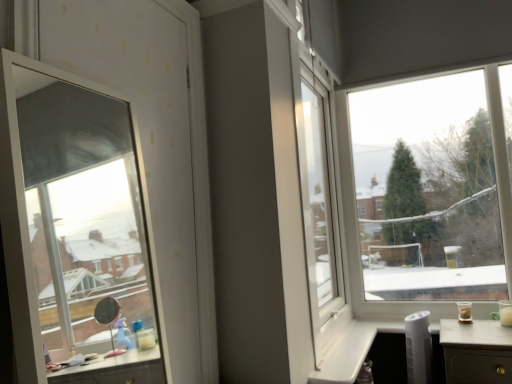
Image resolution: width=512 pixels, height=384 pixels. Find the location of `transparent glass window at left, which appears as the 1th window when viewed from the left`. transparent glass window at left, which appears as the 1th window when viewed from the left is located at coordinates (74, 231).

This screenshot has width=512, height=384. What do you see at coordinates (74, 231) in the screenshot? I see `transparent glass window at left, the second window viewed from the back` at bounding box center [74, 231].

Where is `transparent glass window at upper right, the 1th window when ordered from right to left`? This screenshot has height=384, width=512. transparent glass window at upper right, the 1th window when ordered from right to left is located at coordinates (426, 195).

What do you see at coordinates (426, 195) in the screenshot? I see `transparent glass window at upper right, which is counted as the second window, starting from the left` at bounding box center [426, 195].

Where is `transparent glass window at left, the second window viewed from the back`? This screenshot has width=512, height=384. transparent glass window at left, the second window viewed from the back is located at coordinates (74, 231).

Based on their positions, is transparent glass window at left, the second window viewed from the back, located to the left or right of transparent glass window at upper right, which is the 1th window from back to front?

In the image, transparent glass window at left, the second window viewed from the back, appears on the left side of transparent glass window at upper right, which is the 1th window from back to front.

Which is in front, transparent glass window at left, which is counted as the 2th window, starting from the right, or transparent glass window at upper right, which is counted as the second window, starting from the left?

transparent glass window at left, which is counted as the 2th window, starting from the right.

Which is closer, (x=111, y=93) or (x=503, y=205)?

Point (x=111, y=93) appears to be closer to the viewer than point (x=503, y=205).

From the image's perspective, is transparent glass window at left, the second window viewed from the back, beneath transparent glass window at upper right, which is counted as the second window, starting from the left?

Incorrect, from the image's perspective, transparent glass window at left, the second window viewed from the back, is higher than transparent glass window at upper right, which is counted as the second window, starting from the left.

From a real-world perspective, is transparent glass window at left, which appears as the 1th window when viewed from the left, above or below transparent glass window at upper right, the second window positioned from the front?

transparent glass window at left, which appears as the 1th window when viewed from the left, is above transparent glass window at upper right, the second window positioned from the front.

Between transparent glass window at left, which appears as the 1th window when viewed from the left, and transparent glass window at upper right, which is the 1th window from back to front, which one has smaller width?

Thinner between the two is transparent glass window at left, which appears as the 1th window when viewed from the left.

Between transparent glass window at left, the second window viewed from the back, and transparent glass window at upper right, which is the 1th window from back to front, which one has more height?

transparent glass window at upper right, which is the 1th window from back to front, is taller.

Does transparent glass window at left, arranged as the 1th window when viewed from the front, have a smaller size compared to transparent glass window at upper right, which is counted as the second window, starting from the left?

Yes.

Would you say transparent glass window at upper right, the second window positioned from the front, is part of transparent glass window at left, arranged as the 1th window when viewed from the front,'s contents?

No, transparent glass window at upper right, the second window positioned from the front, is not surrounded by transparent glass window at left, arranged as the 1th window when viewed from the front.

Are transparent glass window at left, which is counted as the 2th window, starting from the right, and transparent glass window at upper right, which is the 1th window from back to front, located far from each other?

That's right, there is a large distance between transparent glass window at left, which is counted as the 2th window, starting from the right, and transparent glass window at upper right, which is the 1th window from back to front.

Is transparent glass window at left, which is counted as the 2th window, starting from the right, facing towards transparent glass window at upper right, the 1th window when ordered from right to left?

No, transparent glass window at left, which is counted as the 2th window, starting from the right, is not turned towards transparent glass window at upper right, the 1th window when ordered from right to left.

How different are the orientations of transparent glass window at left, which appears as the 1th window when viewed from the left, and transparent glass window at upper right, the second window positioned from the front, in degrees?

91.1 degrees separate the facing orientations of transparent glass window at left, which appears as the 1th window when viewed from the left, and transparent glass window at upper right, the second window positioned from the front.

What are the coordinates of `window on the right side of transparent glass window at left, which is counted as the 2th window, starting from the right` in the screenshot? It's located at (426, 195).

Between transparent glass window at upper right, the 1th window when ordered from right to left, and transparent glass window at left, the second window viewed from the back, which one appears on the left side from the viewer's perspective?

From the viewer's perspective, transparent glass window at left, the second window viewed from the back, appears more on the left side.

Which object is more forward, transparent glass window at upper right, the second window positioned from the front, or transparent glass window at left, which is counted as the 2th window, starting from the right?

transparent glass window at left, which is counted as the 2th window, starting from the right, is more forward.

Does point (381, 248) appear closer or farther from the camera than point (19, 229)?

Point (381, 248) is positioned farther from the camera compared to point (19, 229).

From the image's perspective, between transparent glass window at upper right, which is the 1th window from back to front, and transparent glass window at left, which is counted as the 2th window, starting from the right, which one is located above?

transparent glass window at left, which is counted as the 2th window, starting from the right, appears higher in the image.

From a real-world perspective, is transparent glass window at upper right, which is counted as the second window, starting from the left, located higher than transparent glass window at left, which appears as the 1th window when viewed from the left?

No.

Considering the sizes of objects transparent glass window at upper right, which is the 1th window from back to front, and transparent glass window at left, which is counted as the 2th window, starting from the right, in the image provided, who is wider, transparent glass window at upper right, which is the 1th window from back to front, or transparent glass window at left, which is counted as the 2th window, starting from the right,?

transparent glass window at upper right, which is the 1th window from back to front, is wider.

Looking at this image, is transparent glass window at upper right, the 1th window when ordered from right to left, taller than transparent glass window at left, the second window viewed from the back?

Correct, transparent glass window at upper right, the 1th window when ordered from right to left, is much taller as transparent glass window at left, the second window viewed from the back.

Considering the sizes of transparent glass window at upper right, the second window positioned from the front, and transparent glass window at left, which appears as the 1th window when viewed from the left, in the image, is transparent glass window at upper right, the second window positioned from the front, bigger or smaller than transparent glass window at left, which appears as the 1th window when viewed from the left,?

Clearly, transparent glass window at upper right, the second window positioned from the front, is larger in size than transparent glass window at left, which appears as the 1th window when viewed from the left.

Looking at this image, is transparent glass window at upper right, which is counted as the second window, starting from the left, completely or partially outside of transparent glass window at left, arranged as the 1th window when viewed from the front?

transparent glass window at upper right, which is counted as the second window, starting from the left, lies outside transparent glass window at left, arranged as the 1th window when viewed from the front,'s area.

Are transparent glass window at upper right, which is counted as the second window, starting from the left, and transparent glass window at left, arranged as the 1th window when viewed from the front, making contact?

There is a gap between transparent glass window at upper right, which is counted as the second window, starting from the left, and transparent glass window at left, arranged as the 1th window when viewed from the front.

Could you tell me if transparent glass window at upper right, the second window positioned from the front, is facing transparent glass window at left, which appears as the 1th window when viewed from the left?

Yes, transparent glass window at upper right, the second window positioned from the front, is facing transparent glass window at left, which appears as the 1th window when viewed from the left.

How far apart are transparent glass window at upper right, the second window positioned from the front, and transparent glass window at left, arranged as the 1th window when viewed from the front?

transparent glass window at upper right, the second window positioned from the front, is 5.58 feet away from transparent glass window at left, arranged as the 1th window when viewed from the front.

This screenshot has height=384, width=512. Find the location of `window below the transparent glass window at left, the second window viewed from the back (from a real-world perspective)`. window below the transparent glass window at left, the second window viewed from the back (from a real-world perspective) is located at coordinates (426, 195).

At what (x,y) coordinates should I click in order to perform the action: click on window that is under the transparent glass window at left, arranged as the 1th window when viewed from the front (from a real-world perspective). Please return your answer as a coordinate pair (x, y). The width and height of the screenshot is (512, 384). Looking at the image, I should click on (426, 195).

In the image, there is a transparent glass window at upper right, the second window positioned from the front. Where is `window above it (from the image's perspective)`? This screenshot has height=384, width=512. window above it (from the image's perspective) is located at coordinates (74, 231).